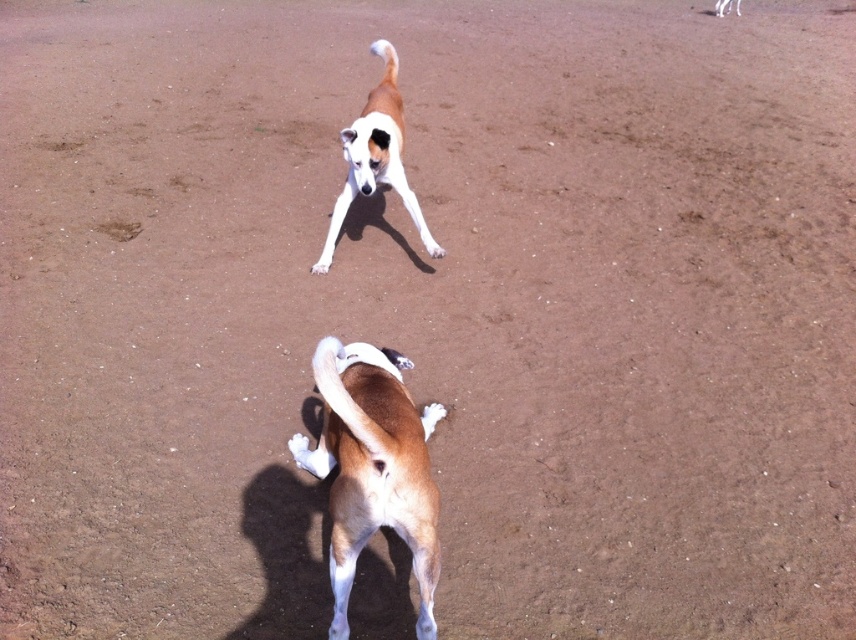
Question: Which of the following is the farthest from the observer?

Choices:
 (A) brown matte dog at center
 (B) brown and white fur dog at center

Answer: (B)

Question: Considering the relative positions of brown matte dog at center and brown and white fur dog at center in the image provided, where is brown matte dog at center located with respect to brown and white fur dog at center?

Choices:
 (A) left
 (B) right

Answer: (B)

Question: Does brown matte dog at center appear on the left side of brown and white fur dog at center?

Choices:
 (A) no
 (B) yes

Answer: (A)

Question: Is brown matte dog at center smaller than brown and white fur dog at center?

Choices:
 (A) yes
 (B) no

Answer: (A)

Question: Which of the following is the closest to the observer?

Choices:
 (A) (432, 588)
 (B) (337, 230)

Answer: (A)